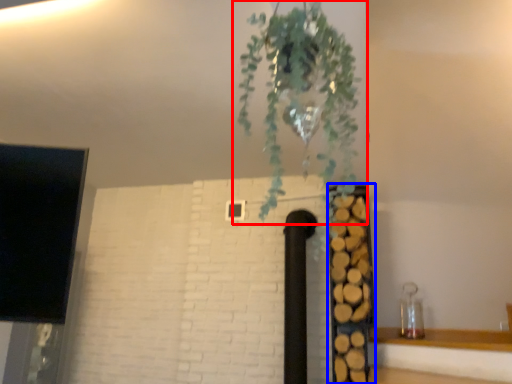
Question: Which of the following is the closest to the observer, houseplant (highlighted by a red box) or shelf (highlighted by a blue box)?

Choices:
 (A) houseplant
 (B) shelf

Answer: (A)